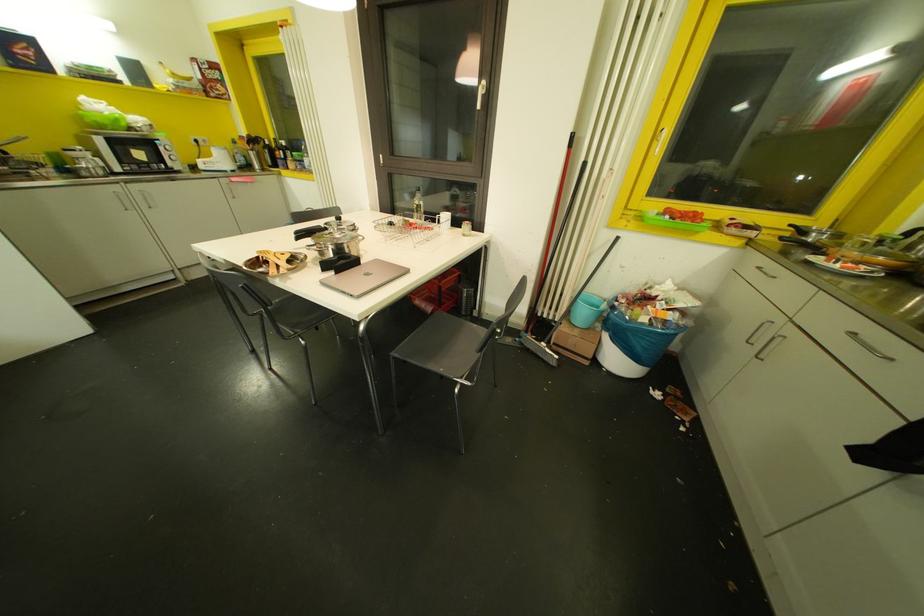
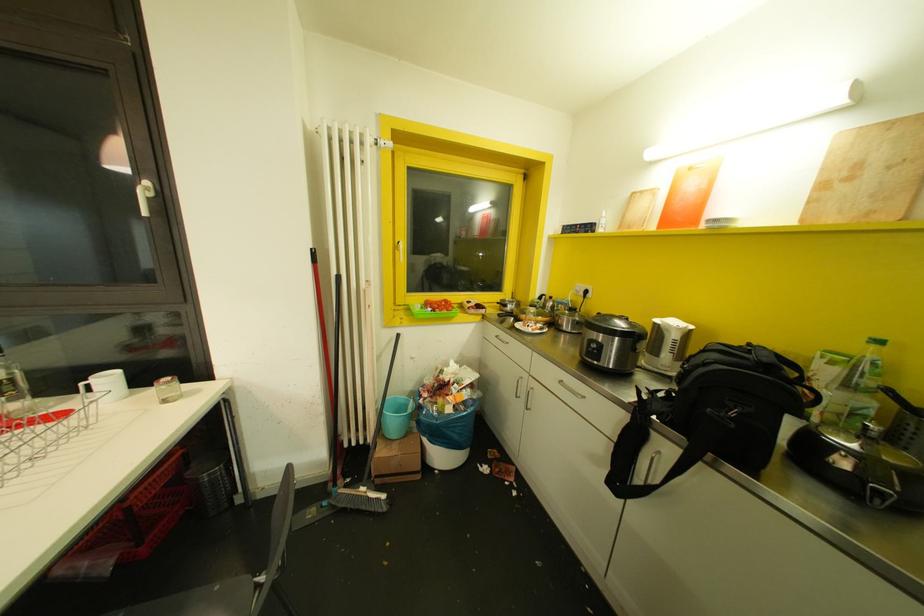
Question: The first image is from the beginning of the video and the second image is from the end. How did the camera likely rotate when shooting the video?

Choices:
 (A) Left
 (B) Right
 (C) Up
 (D) Down

Answer: (B)